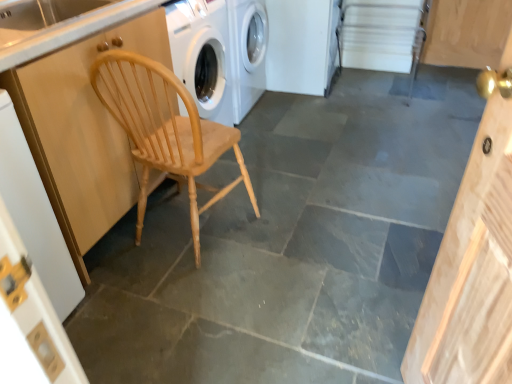
Question: From a real-world perspective, does natural wood cabinet at left sit lower than wooden door at left?

Choices:
 (A) no
 (B) yes

Answer: (A)

Question: Could you tell me if natural wood cabinet at left is turned towards wooden door at left?

Choices:
 (A) no
 (B) yes

Answer: (A)

Question: Does natural wood cabinet at left lie behind wooden door at left?

Choices:
 (A) no
 (B) yes

Answer: (B)

Question: Is natural wood cabinet at left to the left of wooden door at left from the viewer's perspective?

Choices:
 (A) yes
 (B) no

Answer: (B)

Question: Does natural wood cabinet at left have a smaller size compared to wooden door at left?

Choices:
 (A) yes
 (B) no

Answer: (B)

Question: Can you confirm if natural wood cabinet at left is shorter than wooden door at left?

Choices:
 (A) no
 (B) yes

Answer: (A)

Question: Can you confirm if natural wood cabinet at left is smaller than natural wood chair at left?

Choices:
 (A) no
 (B) yes

Answer: (A)

Question: From a real-world perspective, is natural wood cabinet at left located beneath natural wood chair at left?

Choices:
 (A) yes
 (B) no

Answer: (B)

Question: Can you confirm if natural wood cabinet at left is wider than natural wood chair at left?

Choices:
 (A) yes
 (B) no

Answer: (A)

Question: Does natural wood cabinet at left have a lesser height compared to natural wood chair at left?

Choices:
 (A) yes
 (B) no

Answer: (B)

Question: Is natural wood cabinet at left positioned before natural wood chair at left?

Choices:
 (A) yes
 (B) no

Answer: (A)

Question: From the image's perspective, would you say natural wood cabinet at left is shown under natural wood chair at left?

Choices:
 (A) no
 (B) yes

Answer: (A)

Question: Does white glossy counter top at upper left have a larger size compared to wooden door at left?

Choices:
 (A) yes
 (B) no

Answer: (B)